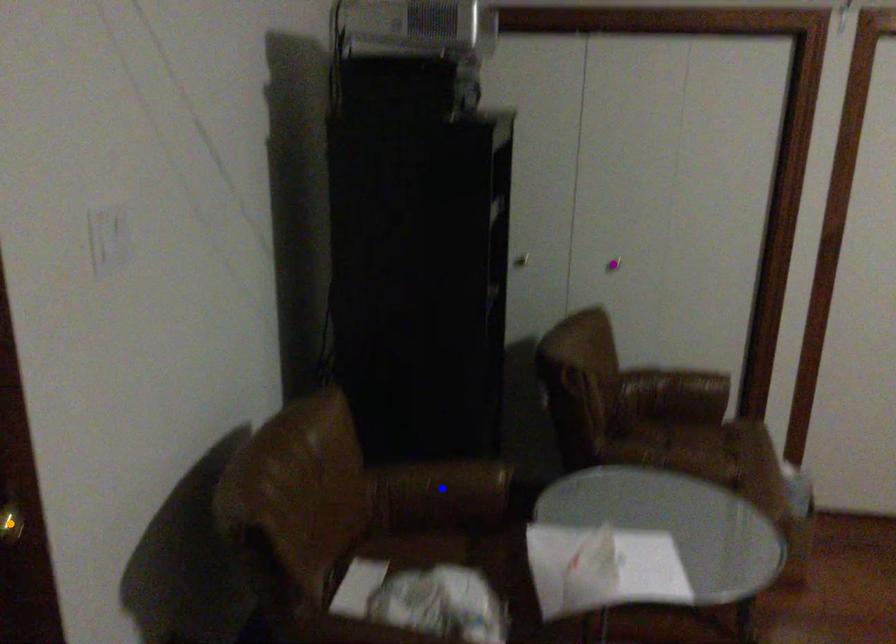
Order these from nearest to farthest:
purple point | orange point | blue point

orange point → blue point → purple point